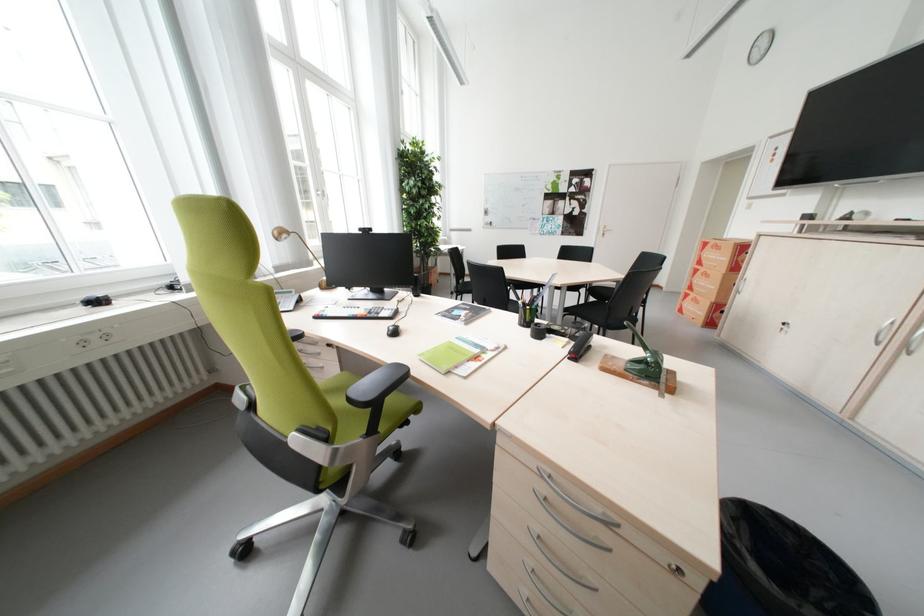
Which object does [579,345] point to?

This point indicates the black stapler.